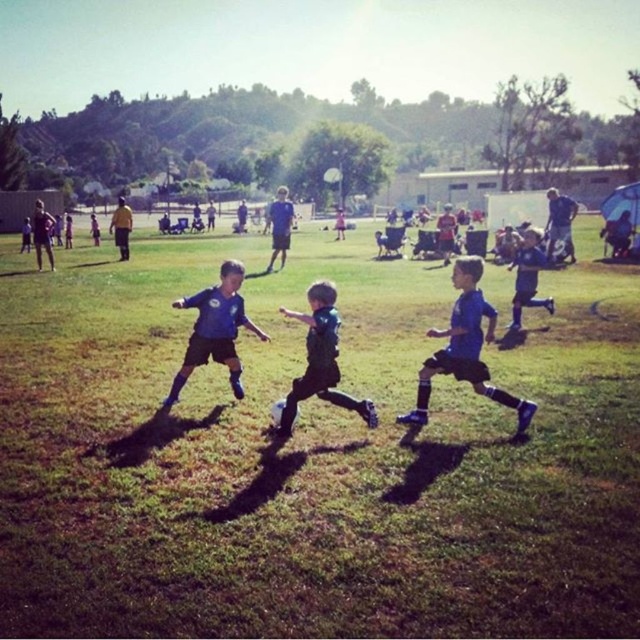
You are a photographer standing at the edge of the soccer field. You want to take a photo that includes both the dark blue jersey at center and the blue matte soccer jersey at right. What is the minimum distance you need to move backward to ensure both are in frame?

The dark blue jersey at center is 5.53 meters away from the blue matte soccer jersey at right. To include both in the frame, you need to move backward until you are at least 5.53 meters away from the closer jersey.

You are a photographer trying to capture a photo of both the blue jersey at center and the blue matte soccer jersey at right. Since you want to show their sizes accurately, which one should you focus on first to ensure proper framing?

The blue jersey at center has a greater height compared to the blue matte soccer jersey at right, so you should focus on the blue jersey at center first to ensure proper framing as it is larger and needs more attention in the composition.

You are a photographer trying to capture a clear shot of the blue matte soccer player at center and the blue jersey at center. Which object should you focus on to ensure it appears more prominent in the photo?

The blue matte soccer player at center is larger in size than the blue jersey at center, so focusing on it will make it appear more prominent in the photo.